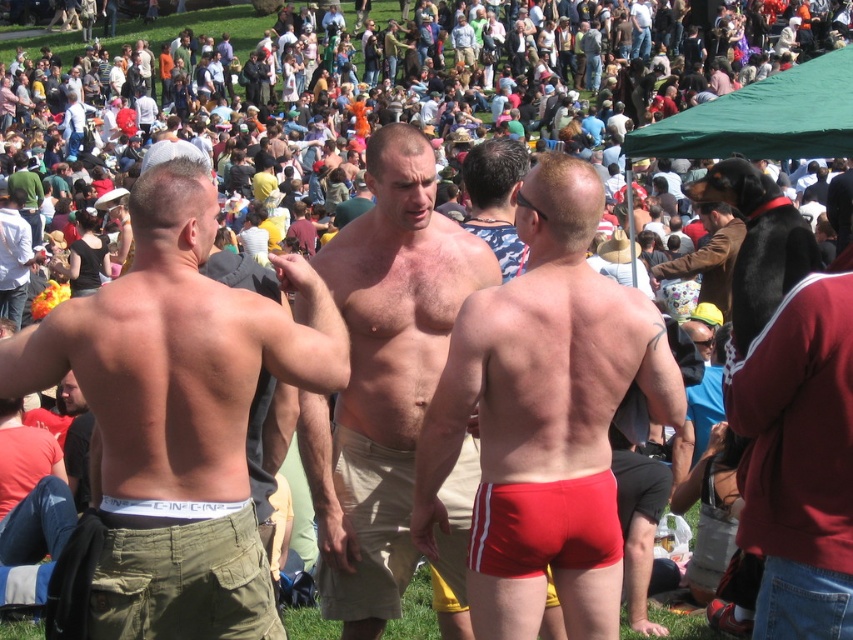
Does point (476, 570) come farther from viewer compared to point (770, 600)?

Yes, it is.

Is red matte boxer shorts at center taller than red fabric jacket at right?

Correct, red matte boxer shorts at center is much taller as red fabric jacket at right.

Is point (521, 531) farther from viewer compared to point (772, 372)?

Yes, it is.

Where is `red matte boxer shorts at center`? The height and width of the screenshot is (640, 853). red matte boxer shorts at center is located at coordinates (544, 417).

Does red fabric jacket at right appear on the left side of green fabric canopy at upper right?

Yes, red fabric jacket at right is to the left of green fabric canopy at upper right.

Is point (772, 470) positioned before point (831, 148)?

Yes.

Measure the distance between red fabric jacket at right and camera.

red fabric jacket at right and camera are 13.58 meters apart from each other.

This screenshot has width=853, height=640. I want to click on red fabric jacket at right, so click(x=798, y=458).

Is point (248, 515) behind point (608, 554)?

That is False.

Is white matte underwear at center in front of red smooth boxer shorts at lower center?

Yes, white matte underwear at center is closer to the viewer.

Which is in front, point (195, 580) or point (592, 524)?

Positioned in front is point (195, 580).

Locate an element on the screen. Image resolution: width=853 pixels, height=640 pixels. white matte underwear at center is located at coordinates (178, 413).